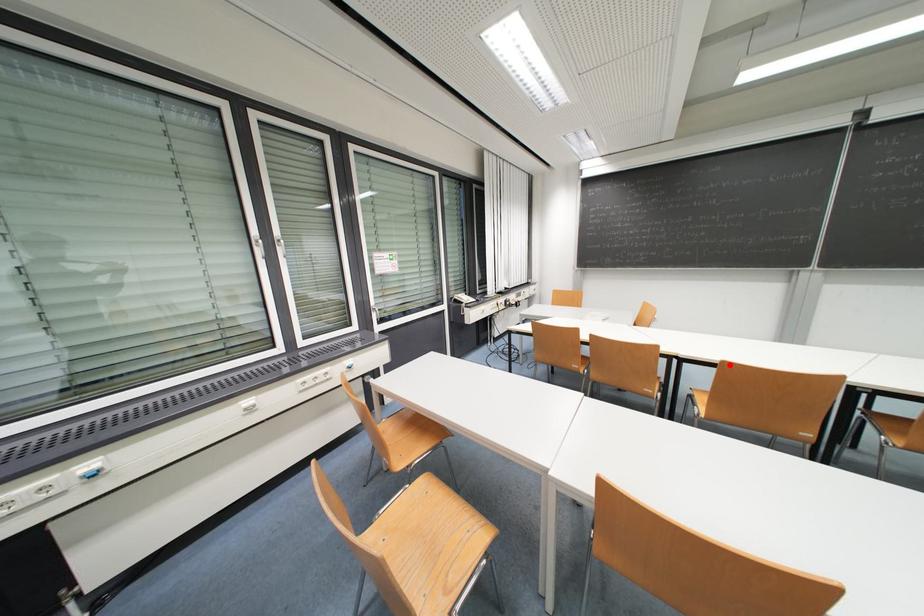
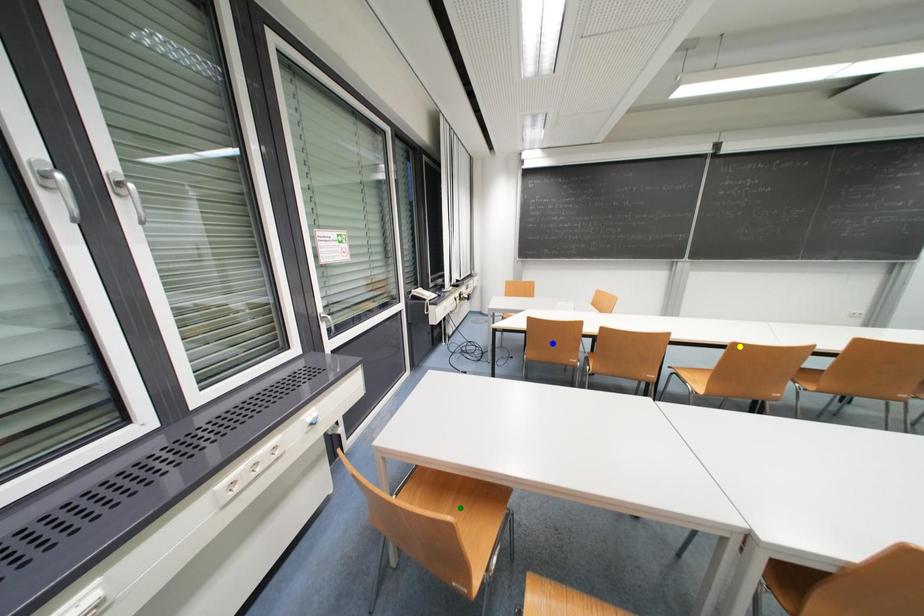
Question: I am providing you with two images of the same scene from different viewpoints. A red point is marked on the first image. You are given multiple points on the second image. In image 2, which mark is for the same physical point as the one in image 1?

Choices:
 (A) yellow point
 (B) green point
 (C) blue point

Answer: (A)